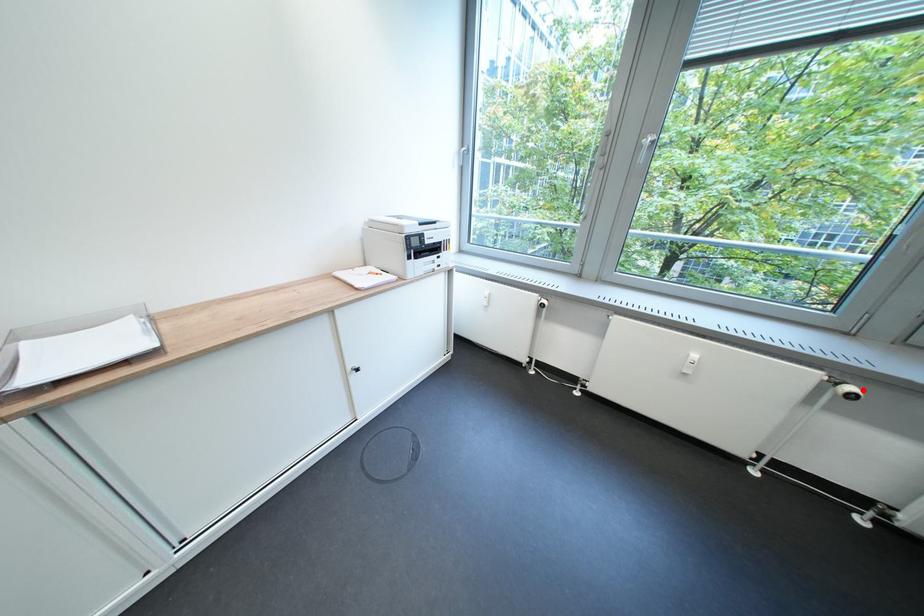
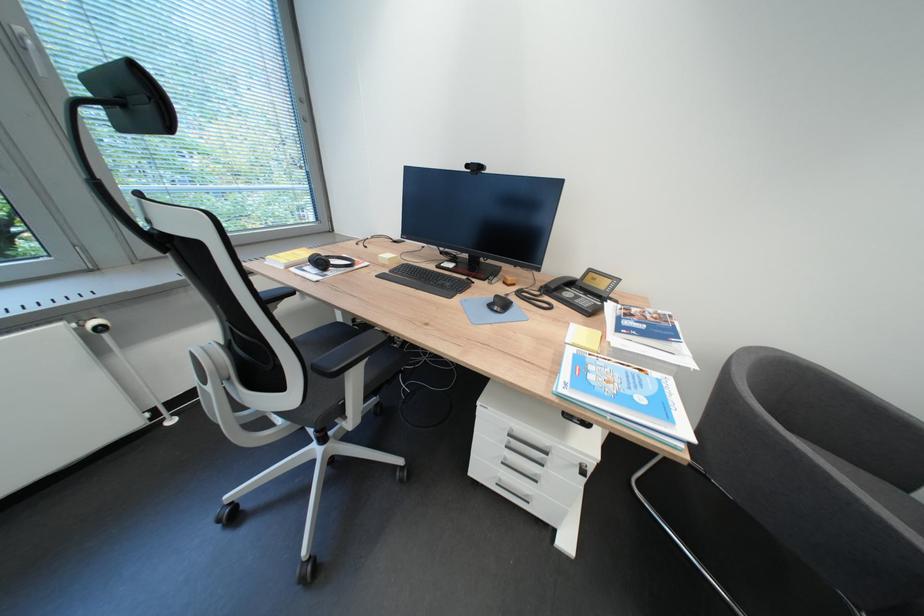
The point at the highlighted location is marked in the first image. Where is the corresponding point in the second image?

(106, 325)